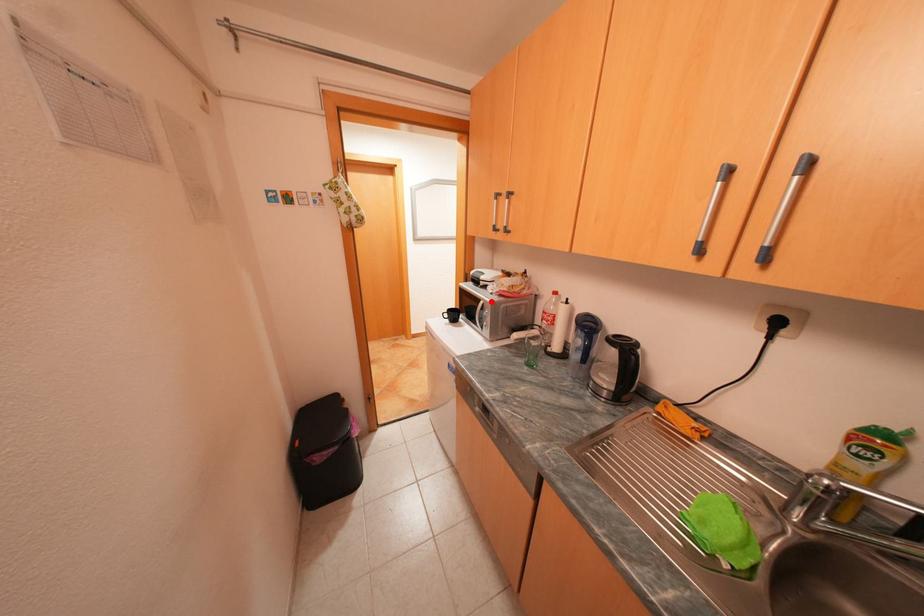
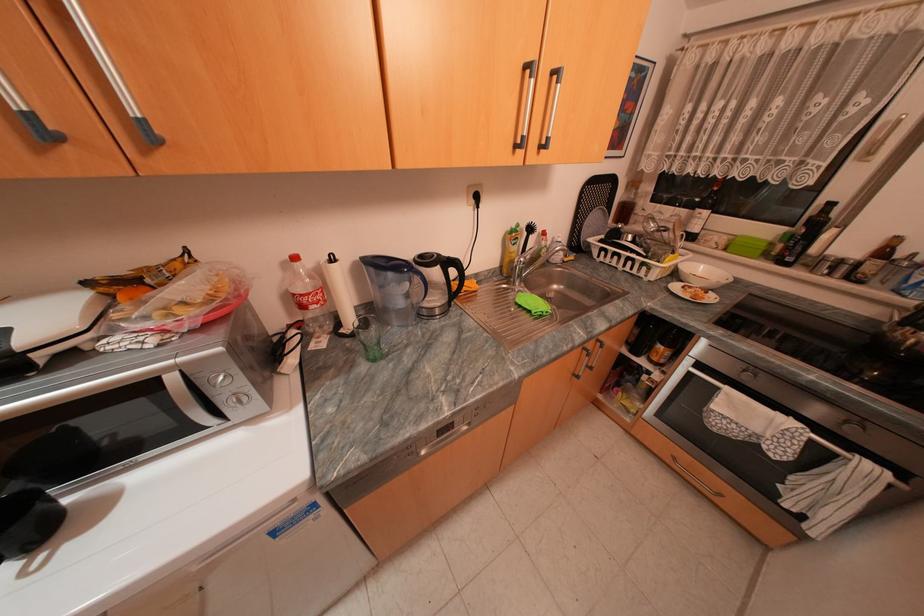
Find the pixel in the second image that matches the highlighted location in the first image.

(181, 378)